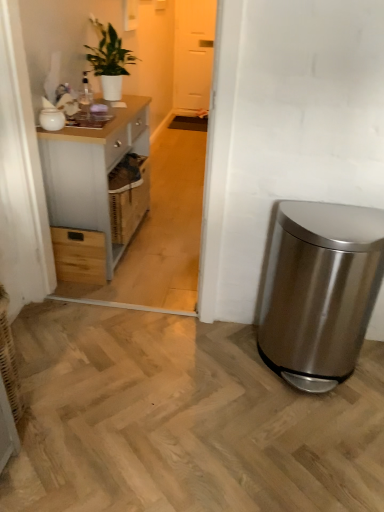
Question: Is wooden drawer at left to the left or to the right of white glossy jar at upper left in the image?

Choices:
 (A) left
 (B) right

Answer: (B)

Question: Is wooden drawer at left bigger or smaller than white glossy jar at upper left?

Choices:
 (A) small
 (B) big

Answer: (B)

Question: Which of these objects is positioned closest to the green glossy plant at upper left?

Choices:
 (A) stainless steel trash can at lower right
 (B) transparent glass door at upper center
 (C) wooden drawer at left
 (D) light gray wood cabinet at left
 (E) white glossy jar at upper left

Answer: (D)

Question: Estimate the real-world distances between objects in this image. Which object is closer to the light gray wood cabinet at left?

Choices:
 (A) transparent glass door at upper center
 (B) wooden drawer at left
 (C) stainless steel trash can at lower right
 (D) green glossy plant at upper left
 (E) white glossy jar at upper left

Answer: (B)